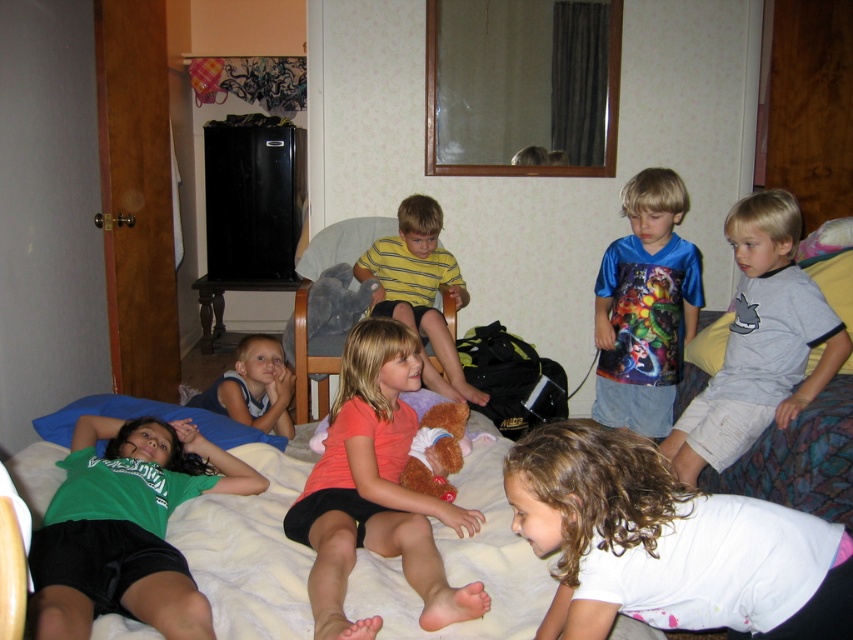
Based on the photo, you are a photographer setting up a camera in the hotel room scene. You need to ensure both the yellow striped shirt at center and the blue fabric shirt at lower left are clearly visible in the shot. Given their sizes, which shirt might require more careful framing to avoid being overshadowed?

The blue fabric shirt at lower left is narrower than the yellow striped shirt at center, so it might require more careful framing to ensure it is clearly visible and not overshadowed by the larger shirt.

You are a photographer standing in the hotel room scene. You want to take a photo of the green matte shirt at lower left and orange matte shirt at center. The camera you are using has a minimum focus distance of 30 centimeters. Will both shirts be in focus if you position the camera to capture both in the frame?

The green matte shirt at lower left is 37.62 centimeters from the orange matte shirt at center. Since the distance between them is greater than the camera minimum focus distance of 30 centimeters, both shirts will be in focus.